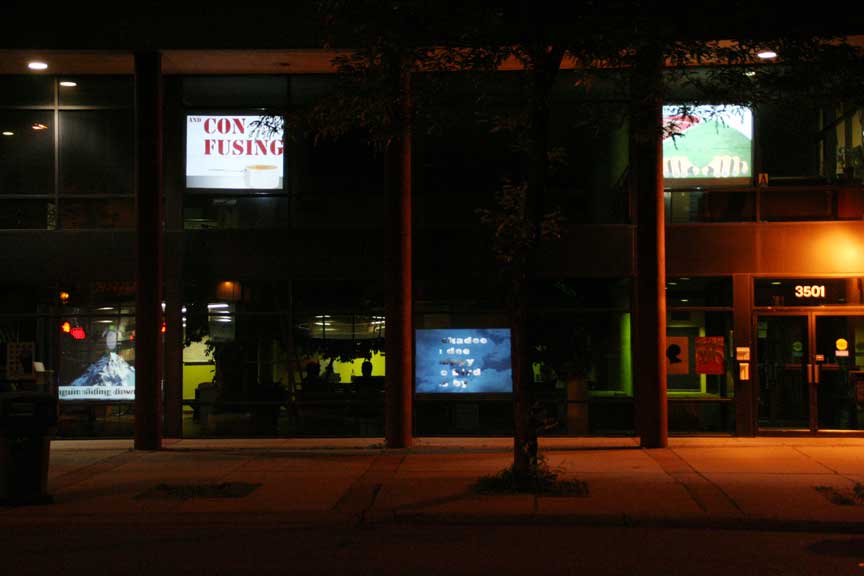
At what (x,y) coordinates should I click in order to perform the action: click on columns. Please return your answer as a coordinate pair (x, y). Looking at the image, I should click on (398, 272), (159, 321), (658, 334).